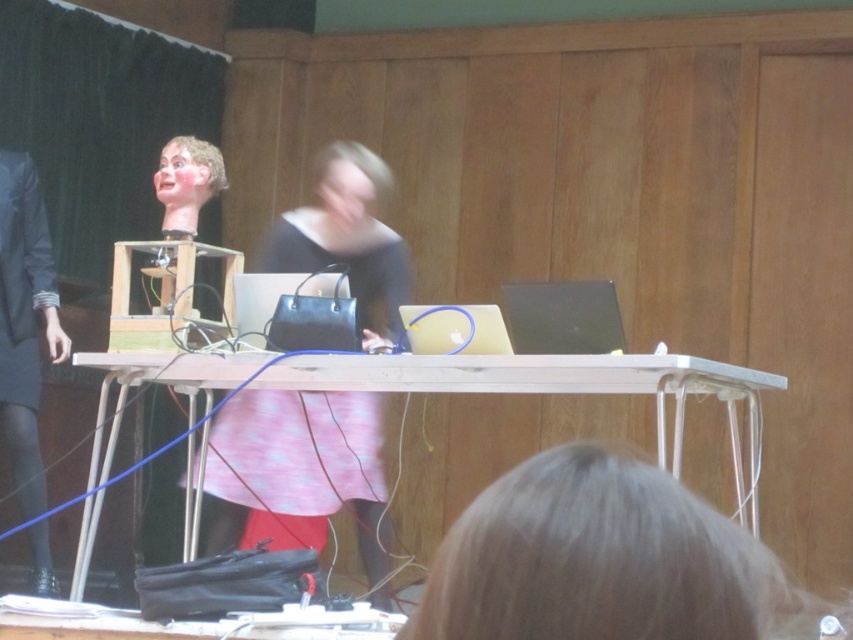
Question: In this image, where is pink fabric skirt at center located relative to wooden table at center?

Choices:
 (A) above
 (B) below

Answer: (B)

Question: Which of the following is the farthest from the observer?

Choices:
 (A) (660, 417)
 (B) (373, 262)
 (C) (15, 220)

Answer: (C)

Question: Which point is farther to the camera?

Choices:
 (A) wooden table at center
 (B) dark gray fabric business suit at left

Answer: (B)

Question: Can you confirm if pink fabric skirt at center is positioned below dark gray fabric business suit at left?

Choices:
 (A) no
 (B) yes

Answer: (B)

Question: Which object appears farthest from the camera in this image?

Choices:
 (A) wooden table at center
 (B) dark gray fabric business suit at left

Answer: (B)

Question: Is pink fabric skirt at center further to camera compared to wooden table at center?

Choices:
 (A) yes
 (B) no

Answer: (A)